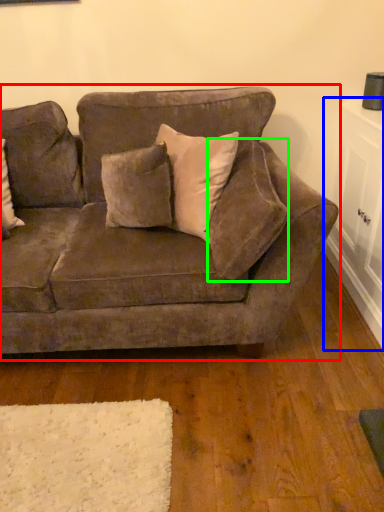
Question: Based on their relative distances, which object is nearer to studio couch (highlighted by a red box)? Choose from table (highlighted by a blue box) and pillow (highlighted by a green box).

Choices:
 (A) table
 (B) pillow

Answer: (B)